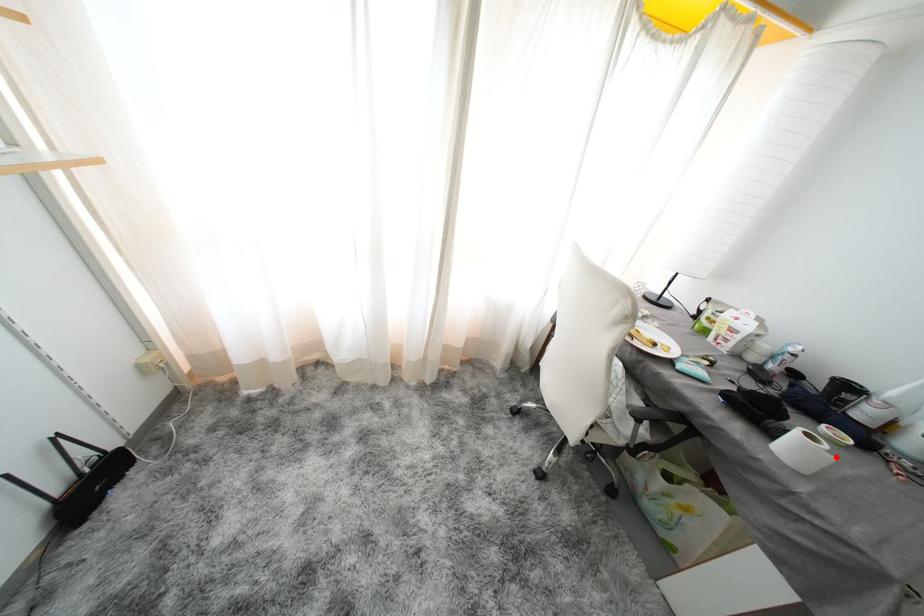
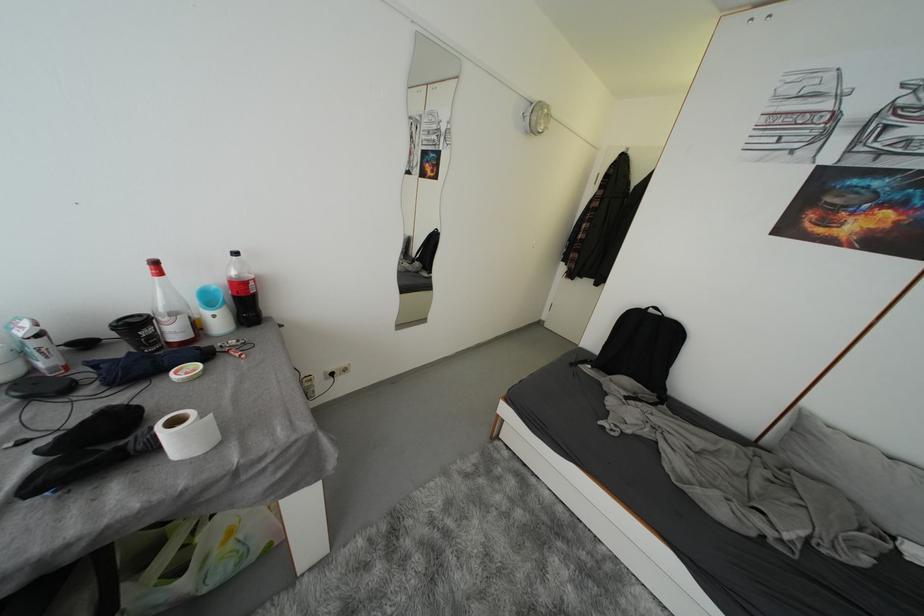
Locate, in the second image, the point that corresponds to the highlighted location in the first image.

(208, 419)